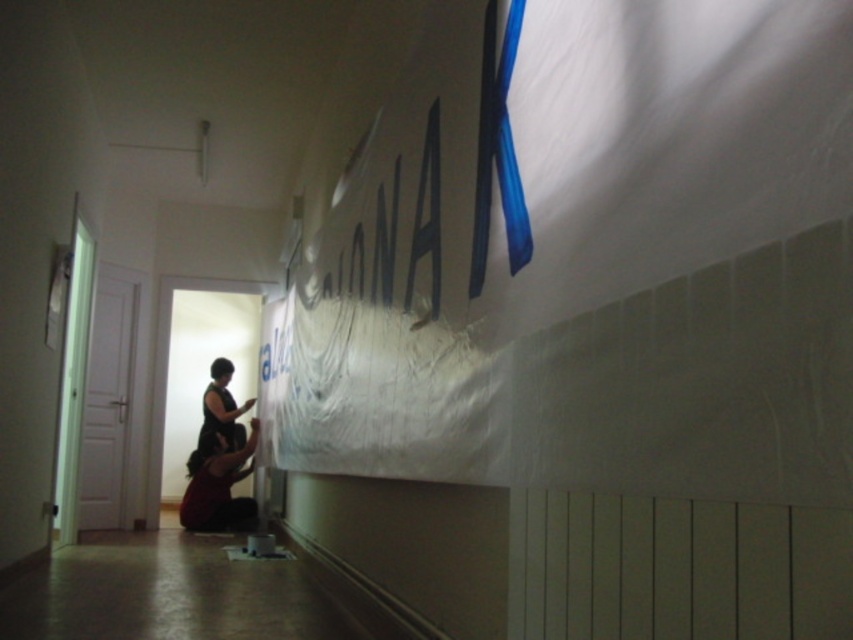
At what (x,y) coordinates should I click in order to perform the action: click on dark red fabric at lower center. Please return your answer as a coordinate pair (x, y). The width and height of the screenshot is (853, 640). Looking at the image, I should click on pos(218,486).

This screenshot has width=853, height=640. Identify the location of dark red fabric at lower center. (218, 486).

Where is `dark red fabric at lower center`? dark red fabric at lower center is located at coordinates (218, 486).